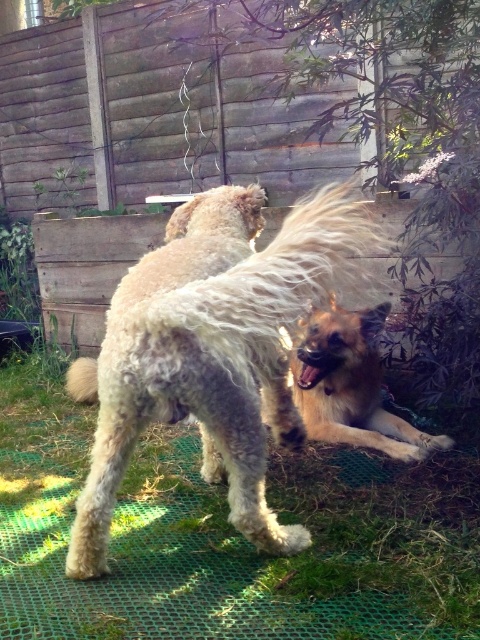
Question: Is green grass at center above golden brown fur at lower right?

Choices:
 (A) no
 (B) yes

Answer: (A)

Question: Which of the following is the farthest from the observer?

Choices:
 (A) (227, 385)
 (B) (373, 381)

Answer: (B)

Question: Which object is the farthest from the fuzzy beige dog at center?

Choices:
 (A) green grass at center
 (B) golden brown fur at lower right

Answer: (A)

Question: Is green grass at center wider than golden brown fur at lower right?

Choices:
 (A) yes
 (B) no

Answer: (A)

Question: Which of these objects is positioned farthest from the fuzzy beige dog at center?

Choices:
 (A) golden brown fur at lower right
 (B) green grass at center

Answer: (B)

Question: Can you confirm if green grass at center is bigger than golden brown fur at lower right?

Choices:
 (A) yes
 (B) no

Answer: (A)